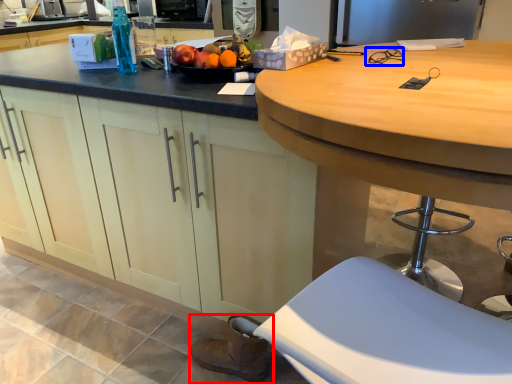
Question: Which object is closer to the camera taking this photo, footwear (highlighted by a red box) or glasses (highlighted by a blue box)?

Choices:
 (A) footwear
 (B) glasses

Answer: (B)